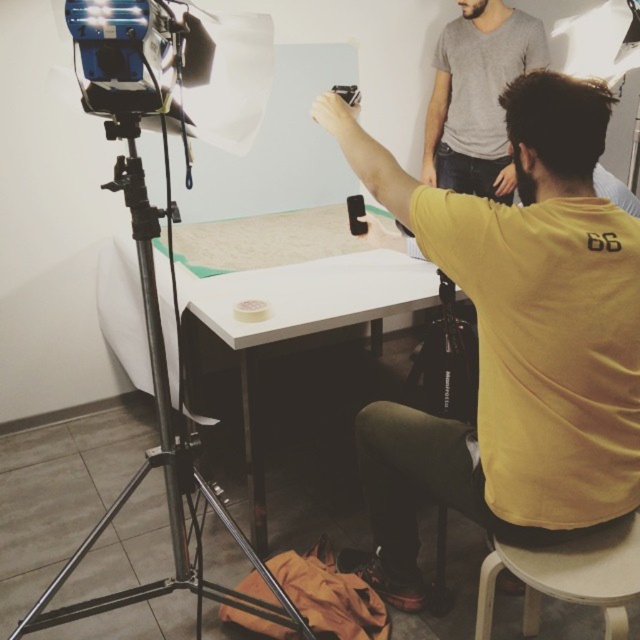
Question: Does white matte table at center appear over black metal tripod at left?

Choices:
 (A) no
 (B) yes

Answer: (B)

Question: Is yellow matte shirt at center closer to camera compared to white plastic stool at lower right?

Choices:
 (A) yes
 (B) no

Answer: (A)

Question: Which of these objects is positioned farthest from the black metal tripod at left?

Choices:
 (A) yellow matte shirt at center
 (B) white plastic stool at lower right
 (C) white matte table at center

Answer: (B)

Question: Which point is closer to the camera?

Choices:
 (A) black metal tripod at left
 (B) yellow matte shirt at center

Answer: (A)

Question: Which of these objects is positioned farthest from the white plastic stool at lower right?

Choices:
 (A) yellow matte shirt at center
 (B) white matte table at center
 (C) black metal tripod at left

Answer: (B)

Question: Considering the relative positions of black metal tripod at left and white plastic stool at lower right in the image provided, where is black metal tripod at left located with respect to white plastic stool at lower right?

Choices:
 (A) left
 (B) right

Answer: (A)